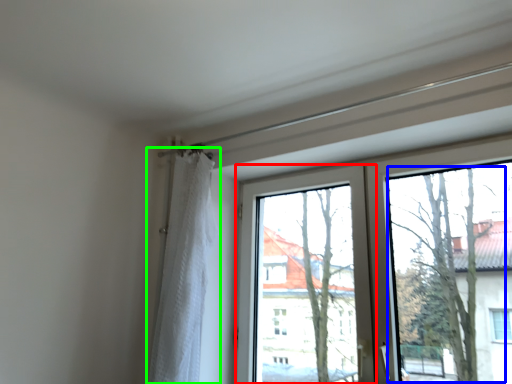
Question: Which object is the closest to the window screen (highlighted by a red box)? Choose among these: tree (highlighted by a blue box) or curtain (highlighted by a green box).

Choices:
 (A) tree
 (B) curtain

Answer: (A)